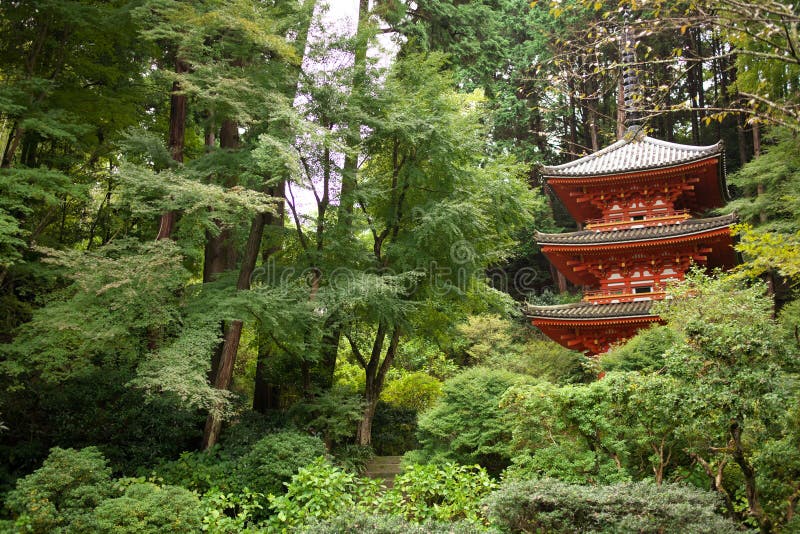
You are a GUI agent. You are given a task and a screenshot of the screen. Output one action in this format:
    pyautogui.click(x=<x>, y=<y>)
    Task: Click on the windows
    The image size is (800, 534).
    Given the screenshot: What is the action you would take?
    pyautogui.click(x=645, y=285), pyautogui.click(x=637, y=217)